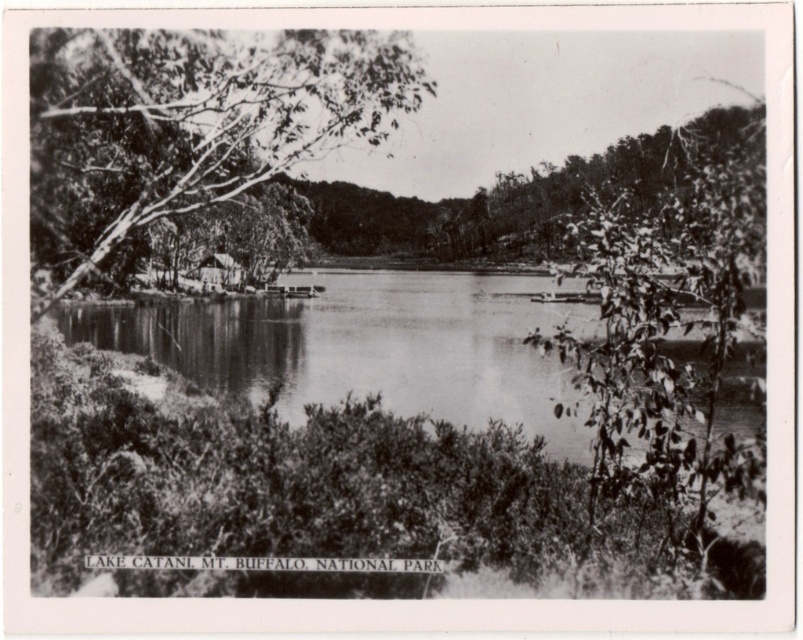
You are planning to take a photo of the wooden cabin at center and the smooth water at center from the lakeside. Based on their positions, which object will appear taller in your photo?

The smooth water at center appears taller in the photo because it has a greater height compared to the wooden cabin at center according to the description.

You are a photographer trying to capture the reflection of the trees in the smooth water at center. You notice a point marked at coordinates (369, 346). Is this point located on the smooth water at center where you can get a clear reflection?

Yes, the point (369, 346) is on the smooth water at center, which is ideal for capturing clear tree reflections.

You are planning to build a small wooden walkway between the smooth bark tree at left and the smooth water at center. Since the walkway must be wider than both objects to accommodate visitors, will the current width of the walkway be sufficient?

The smooth bark tree at left is narrower than the smooth water at center. Since the walkway must be wider than both, the width needs to be greater than the smooth water at center. However, the exact width of the water isn not provided, so we cannot confirm sufficiency without additional information.